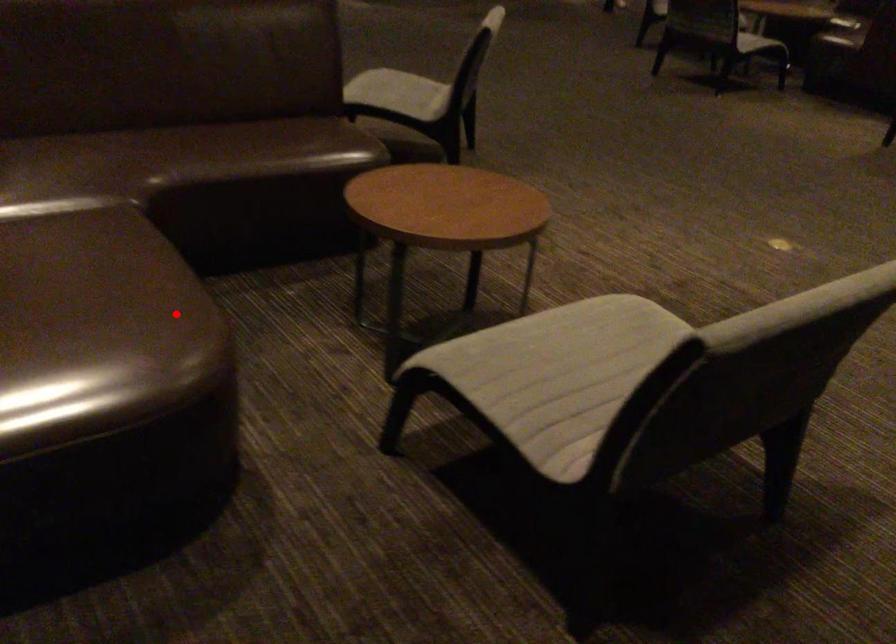
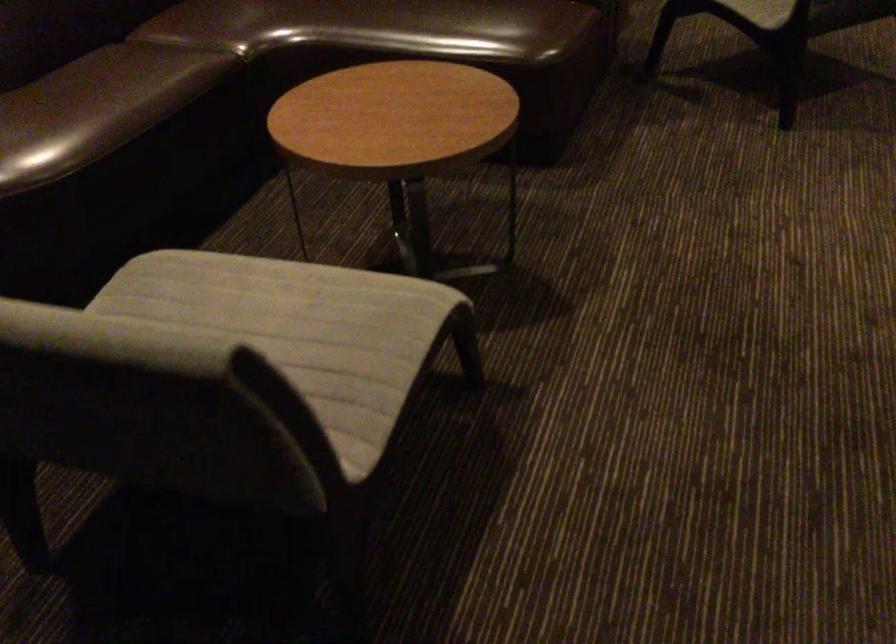
Question: I am providing you with two images of the same scene from different viewpoints. Image1 has a red point marked. In image2, the corresponding 3D location appears at what relative position? Reply with the corresponding letter.

Choices:
 (A) Closer
 (B) Farther

Answer: (B)